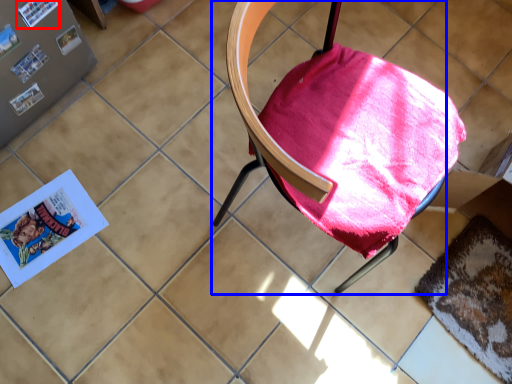
Question: Among these objects, which one is farthest to the camera, paperback book (highlighted by a red box) or chair (highlighted by a blue box)?

Choices:
 (A) paperback book
 (B) chair

Answer: (A)